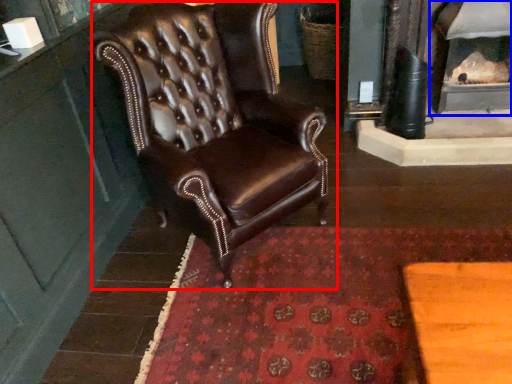
Question: Among these objects, which one is farthest to the camera, chair (highlighted by a red box) or fireplace (highlighted by a blue box)?

Choices:
 (A) chair
 (B) fireplace

Answer: (B)